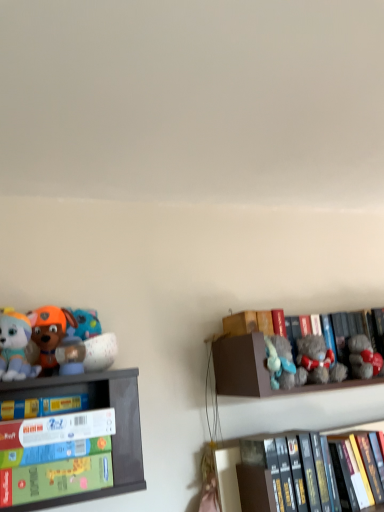
This screenshot has width=384, height=512. In order to click on matte white bowl at upper left, which appears as the 3th toy when viewed from the right in this screenshot , I will do `click(94, 340)`.

What do you see at coordinates (94, 340) in the screenshot? The height and width of the screenshot is (512, 384). I see `matte white bowl at upper left, the third toy from the left` at bounding box center [94, 340].

Locate an element on the screen. soft plush dog at left, the 1th toy in the left-to-right sequence is located at coordinates (15, 346).

In order to click on gray plush bear at right, which is the 4th toy in left-to-right order in this screenshot , I will do `click(319, 360)`.

Where is `matte white bowl at upper left, the third toy from the left`? Image resolution: width=384 pixels, height=512 pixels. matte white bowl at upper left, the third toy from the left is located at coordinates (94, 340).

Can you see cardboard game box at left, the third shelf viewed from the right, touching matte white bowl at upper left, which appears as the 3th toy when viewed from the right?

No, cardboard game box at left, the third shelf viewed from the right, is not in contact with matte white bowl at upper left, which appears as the 3th toy when viewed from the right.

From a real-world perspective, relative to matte white bowl at upper left, the third toy from the left, is cardboard game box at left, the third shelf viewed from the right, vertically above or below?

cardboard game box at left, the third shelf viewed from the right, is situated lower than matte white bowl at upper left, the third toy from the left, in the real world.

From the image's perspective, between cardboard game box at left, the third shelf viewed from the right, and matte white bowl at upper left, the third toy from the left, which one is located above?

matte white bowl at upper left, the third toy from the left, from the image's perspective.

From the image's perspective, is black hardcover books at lower right, which is counted as the 2th shelf, starting from the right, positioned above or below matte white bowl at upper left, which appears as the 3th toy when viewed from the right?

Based on their image positions, black hardcover books at lower right, which is counted as the 2th shelf, starting from the right, is located beneath matte white bowl at upper left, which appears as the 3th toy when viewed from the right.

Which of these two, black hardcover books at lower right, marked as the 2th shelf in a left-to-right arrangement, or matte white bowl at upper left, the third toy from the left, stands taller?

black hardcover books at lower right, marked as the 2th shelf in a left-to-right arrangement.

Which of these two, black hardcover books at lower right, which is counted as the 2th shelf, starting from the right, or matte white bowl at upper left, which appears as the 3th toy when viewed from the right, is wider?

black hardcover books at lower right, which is counted as the 2th shelf, starting from the right, is wider.

Which toy is the 1st one when counting from the left side of the black hardcover books at lower right, which is counted as the 2th shelf, starting from the right? Please provide its 2D coordinates.

[(94, 340)]

You are a GUI agent. You are given a task and a screenshot of the screen. Output one action in this format:
    pyautogui.click(x=<x>, y=<y>)
    Task: Click on the 2nd toy counting from the left of the gray plush bear at right, placed as the 5th toy when sorted from left to right
    
    Given the screenshot: What is the action you would take?
    pyautogui.click(x=94, y=340)

Which of these two, matte white bowl at upper left, which appears as the 3th toy when viewed from the right, or gray plush bear at right, the 1th toy in the right-to-left sequence, is bigger?

matte white bowl at upper left, which appears as the 3th toy when viewed from the right, is bigger.

What's the angular difference between matte white bowl at upper left, which appears as the 3th toy when viewed from the right, and gray plush bear at right, the 1th toy in the right-to-left sequence,'s facing directions?

The angular difference between matte white bowl at upper left, which appears as the 3th toy when viewed from the right, and gray plush bear at right, the 1th toy in the right-to-left sequence, is 1.42 degrees.

Is matte white bowl at upper left, which appears as the 3th toy when viewed from the right, wider than gray plush bear at right, the 1th toy in the right-to-left sequence?

Yes, matte white bowl at upper left, which appears as the 3th toy when viewed from the right, is wider than gray plush bear at right, the 1th toy in the right-to-left sequence.

Is gray plush bear at right, the second toy viewed from the right, directly adjacent to orange plush dog at left, arranged as the 4th toy when viewed from the right?

gray plush bear at right, the second toy viewed from the right, and orange plush dog at left, arranged as the 4th toy when viewed from the right, are clearly separated.

I want to click on toy that is the 2nd object to the left of the gray plush bear at right, the second toy viewed from the right, starting at the anchor, so click(x=50, y=331).

From the image's perspective, which is below, black hardcover books at lower right, which is counted as the 2th shelf, starting from the right, or cardboard game box at left, the third shelf viewed from the right?

black hardcover books at lower right, which is counted as the 2th shelf, starting from the right.

Considering the sizes of objects black hardcover books at lower right, which is counted as the 2th shelf, starting from the right, and cardboard game box at left, the first shelf in the left-to-right sequence, in the image provided, who is taller, black hardcover books at lower right, which is counted as the 2th shelf, starting from the right, or cardboard game box at left, the first shelf in the left-to-right sequence,?

With more height is black hardcover books at lower right, which is counted as the 2th shelf, starting from the right.

In the scene shown: Does black hardcover books at lower right, which is counted as the 2th shelf, starting from the right, have a lesser width compared to cardboard game box at left, the first shelf in the left-to-right sequence?

Correct, the width of black hardcover books at lower right, which is counted as the 2th shelf, starting from the right, is less than that of cardboard game box at left, the first shelf in the left-to-right sequence.

Can you confirm if orange plush dog at left, arranged as the 4th toy when viewed from the right, is wider than gray plush bear at right, which is the 4th toy in left-to-right order?

In fact, orange plush dog at left, arranged as the 4th toy when viewed from the right, might be narrower than gray plush bear at right, which is the 4th toy in left-to-right order.

How many degrees apart are the facing directions of orange plush dog at left, arranged as the 4th toy when viewed from the right, and gray plush bear at right, which is the 4th toy in left-to-right order?

0.738 degrees.

Which object is closer to the camera taking this photo, orange plush dog at left, the 2th toy when ordered from left to right, or gray plush bear at right, which is the 4th toy in left-to-right order?

Positioned in front is orange plush dog at left, the 2th toy when ordered from left to right.

Starting from the gray plush bear at right, the second toy viewed from the right, which toy is the 2nd one to the left? Please provide its 2D coordinates.

[(50, 331)]

Based on the photo, considering the sizes of gray plush bear at right, the 1th toy in the right-to-left sequence, and gray plush bear at right, which is the 4th toy in left-to-right order, in the image, is gray plush bear at right, the 1th toy in the right-to-left sequence, taller or shorter than gray plush bear at right, which is the 4th toy in left-to-right order,?

Clearly, gray plush bear at right, the 1th toy in the right-to-left sequence, is shorter compared to gray plush bear at right, which is the 4th toy in left-to-right order.

Where is `toy that is the 1st object located above the gray plush bear at right, the 1th toy in the right-to-left sequence (from the image's perspective)`? The image size is (384, 512). toy that is the 1st object located above the gray plush bear at right, the 1th toy in the right-to-left sequence (from the image's perspective) is located at coordinates (319, 360).

Can you confirm if gray plush bear at right, placed as the 5th toy when sorted from left to right, is wider than gray plush bear at right, which is the 4th toy in left-to-right order?

Correct, the width of gray plush bear at right, placed as the 5th toy when sorted from left to right, exceeds that of gray plush bear at right, which is the 4th toy in left-to-right order.

Starting from the cardboard game box at left, the first shelf in the left-to-right sequence, which toy is the 3rd one behind? Please provide its 2D coordinates.

[(94, 340)]

Image resolution: width=384 pixels, height=512 pixels. Identify the location of the 1st shelf counting from the right of the matte white bowl at upper left, which appears as the 3th toy when viewed from the right. (227, 476).

Estimate the real-world distances between objects in this image. Which object is further from soft plush dog at left, the fifth toy viewed from the right, gray plush bear at right, the 1th toy in the right-to-left sequence, or orange plush dog at left, arranged as the 4th toy when viewed from the right?

gray plush bear at right, the 1th toy in the right-to-left sequence, is positioned further to the anchor soft plush dog at left, the fifth toy viewed from the right.

From the image, which object appears to be nearer to black hardcover books at lower right, which is counted as the 2th shelf, starting from the right, cardboard game box at left, the first shelf in the left-to-right sequence, or yellow matte book at left?

Based on the image, cardboard game box at left, the first shelf in the left-to-right sequence, appears to be nearer to black hardcover books at lower right, which is counted as the 2th shelf, starting from the right.

When comparing their distances from black hardcover books at lower right, which is counted as the 2th shelf, starting from the right, does yellow matte book at left or cardboard game box at left, the third shelf viewed from the right, seem closer?

The object closer to black hardcover books at lower right, which is counted as the 2th shelf, starting from the right, is cardboard game box at left, the third shelf viewed from the right.

Based on the photo, looking at the image, which one is located closer to matte white bowl at upper left, which appears as the 3th toy when viewed from the right, black hardcover books at lower right, which is counted as the 2th shelf, starting from the right, or cardboard game box at left, the first shelf in the left-to-right sequence?

Based on the image, cardboard game box at left, the first shelf in the left-to-right sequence, appears to be nearer to matte white bowl at upper left, which appears as the 3th toy when viewed from the right.

Which object lies further to the anchor point orange plush dog at left, arranged as the 4th toy when viewed from the right, gray plush bear at right, placed as the 5th toy when sorted from left to right, or yellow matte book at left?

The object further to orange plush dog at left, arranged as the 4th toy when viewed from the right, is gray plush bear at right, placed as the 5th toy when sorted from left to right.

From the image, which object appears to be farther from gray plush bear at right, which is the 4th toy in left-to-right order, orange plush dog at left, the 2th toy when ordered from left to right, or yellow matte book at left?

Among the two, orange plush dog at left, the 2th toy when ordered from left to right, is located further to gray plush bear at right, which is the 4th toy in left-to-right order.

From the image, which object appears to be farther from yellow matte book at left, matte white bowl at upper left, which appears as the 3th toy when viewed from the right, or black hardcover books at lower right, marked as the 2th shelf in a left-to-right arrangement?

black hardcover books at lower right, marked as the 2th shelf in a left-to-right arrangement, lies further to yellow matte book at left than the other object.

Estimate the real-world distances between objects in this image. Which object is further from cardboard game box at left, the first shelf in the left-to-right sequence, gray plush bear at right, the 1th toy in the right-to-left sequence, or black hardcover books at lower right, marked as the 2th shelf in a left-to-right arrangement?

Among the two, gray plush bear at right, the 1th toy in the right-to-left sequence, is located further to cardboard game box at left, the first shelf in the left-to-right sequence.

This screenshot has height=512, width=384. I want to click on paperback book between orange plush dog at left, arranged as the 4th toy when viewed from the right, and cardboard game box at left, the first shelf in the left-to-right sequence, in the vertical direction, so click(42, 406).

You are a GUI agent. You are given a task and a screenshot of the screen. Output one action in this format:
    pyautogui.click(x=<x>, y=<y>)
    Task: Click on the shelf situated between cardboard game box at left, the third shelf viewed from the right, and brown cardboard box at upper right, the 3th shelf viewed from the left, from left to right
    This screenshot has height=512, width=384.
    Given the screenshot: What is the action you would take?
    pyautogui.click(x=227, y=476)

Where is `paperback book situated between orange plush dog at left, the 2th toy when ordered from left to right, and gray plush bear at right, placed as the 5th toy when sorted from left to right, from left to right`? Image resolution: width=384 pixels, height=512 pixels. paperback book situated between orange plush dog at left, the 2th toy when ordered from left to right, and gray plush bear at right, placed as the 5th toy when sorted from left to right, from left to right is located at coordinates (42, 406).

Find the location of a particular element. paperback book located between soft plush dog at left, the 1th toy in the left-to-right sequence, and brown cardboard box at upper right, which appears as the first shelf when viewed from the right, in the left-right direction is located at coordinates (42, 406).